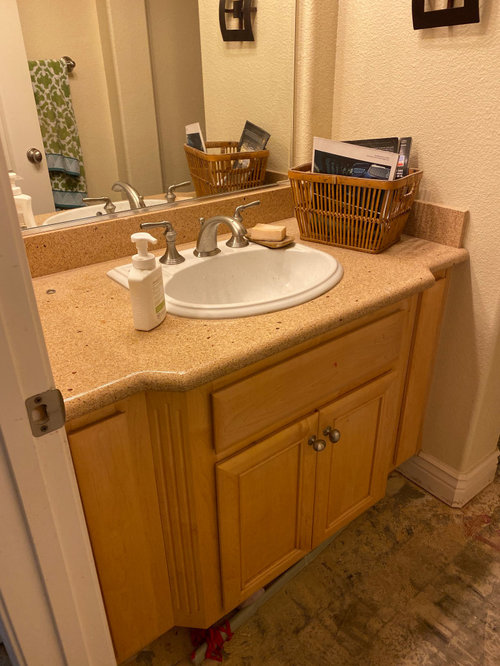
Where is `reflection in the mirror of an opened door`? reflection in the mirror of an opened door is located at coordinates tap(24, 90).